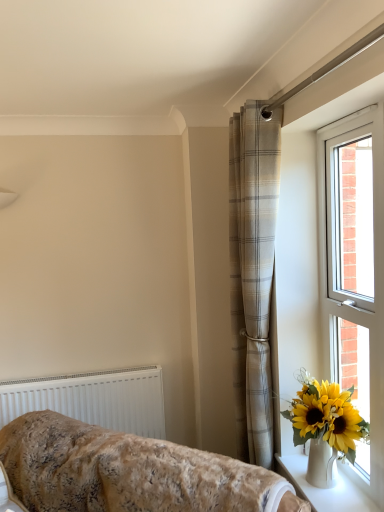
Describe the element at coordinates (128, 472) in the screenshot. I see `fluffy beige blanket at lower left` at that location.

What do you see at coordinates (94, 400) in the screenshot?
I see `white plastic radiator at lower left` at bounding box center [94, 400].

This screenshot has width=384, height=512. I want to click on beige plaid curtain at center, so click(252, 274).

Which of these two, beige plaid curtain at center or white plastic radiator at lower left, is smaller?

Smaller between the two is white plastic radiator at lower left.

Is beige plaid curtain at center facing away from white plastic radiator at lower left?

No, beige plaid curtain at center's orientation is not away from white plastic radiator at lower left.

Considering the sizes of objects beige plaid curtain at center and white plastic radiator at lower left in the image provided, who is thinner, beige plaid curtain at center or white plastic radiator at lower left?

white plastic radiator at lower left.

Between point (256, 360) and point (134, 379), which one is positioned behind?

The point (134, 379) is farther from the camera.

From the image's perspective, which is above, white plastic radiator at lower left or fluffy beige blanket at lower left?

From the image's view, white plastic radiator at lower left is above.

From the picture: From a real-world perspective, between white plastic radiator at lower left and fluffy beige blanket at lower left, who is vertically lower?

fluffy beige blanket at lower left, from a real-world perspective.

Which object is thinner, white plastic radiator at lower left or fluffy beige blanket at lower left?

Thinner between the two is white plastic radiator at lower left.

Considering the sizes of white plastic window at right and beige plaid curtain at center in the image, is white plastic window at right taller or shorter than beige plaid curtain at center?

white plastic window at right is shorter than beige plaid curtain at center.

Would you consider white plastic window at right to be distant from beige plaid curtain at center?

No, white plastic window at right is not far away from beige plaid curtain at center.

Could you tell me if white plastic window at right is turned towards beige plaid curtain at center?

No, white plastic window at right is not facing towards beige plaid curtain at center.

Does white ceramic vase at lower right have a lesser width compared to white plastic window at right?

In fact, white ceramic vase at lower right might be wider than white plastic window at right.

Looking at this image, does white ceramic vase at lower right appear on the left side of white plastic window at right?

Correct, you'll find white ceramic vase at lower right to the left of white plastic window at right.

From their relative heights in the image, would you say white ceramic vase at lower right is taller or shorter than white plastic window at right?

white ceramic vase at lower right is shorter than white plastic window at right.

Is white plastic window at right oriented away from fluffy beige blanket at lower left?

No, white plastic window at right is not facing the opposite direction of fluffy beige blanket at lower left.

This screenshot has width=384, height=512. Find the location of `furniture below the white plastic window at right (from a real-world perspective)`. furniture below the white plastic window at right (from a real-world perspective) is located at coordinates (128, 472).

From the image's perspective, is white plastic window at right over fluffy beige blanket at lower left?

Correct, white plastic window at right appears higher than fluffy beige blanket at lower left in the image.

Could fluffy beige blanket at lower left be considered to be inside white plastic window at right?

No, fluffy beige blanket at lower left is not a part of white plastic window at right.

Considering the relative positions of fluffy beige blanket at lower left and beige plaid curtain at center in the image provided, is fluffy beige blanket at lower left in front of beige plaid curtain at center?

That is True.

From the image's perspective, which one is positioned higher, fluffy beige blanket at lower left or beige plaid curtain at center?

beige plaid curtain at center appears higher in the image.

Considering the sizes of fluffy beige blanket at lower left and beige plaid curtain at center in the image, is fluffy beige blanket at lower left wider or thinner than beige plaid curtain at center?

Clearly, fluffy beige blanket at lower left has more width compared to beige plaid curtain at center.

Based on their sizes in the image, would you say white plastic radiator at lower left is bigger or smaller than white plastic window at right?

Considering their sizes, white plastic radiator at lower left takes up less space than white plastic window at right.

Is the surface of white plastic radiator at lower left in direct contact with white plastic window at right?

white plastic radiator at lower left and white plastic window at right are not in contact.

Which is in front, point (72, 385) or point (344, 306)?

The point (344, 306) is in front.

Is white plastic radiator at lower left facing away from white plastic window at right?

No.

Locate an element on the screen. curtain on the right of white plastic radiator at lower left is located at coordinates (252, 274).

You are a GUI agent. You are given a task and a screenshot of the screen. Output one action in this format:
    pyautogui.click(x=<x>, y=<y>)
    Task: Click on the radiator located on the left of fluffy beige blanket at lower left
    This screenshot has width=384, height=512.
    Given the screenshot: What is the action you would take?
    pyautogui.click(x=94, y=400)

Estimate the real-world distances between objects in this image. Which object is closer to fluffy beige blanket at lower left, white plastic radiator at lower left or white plastic window at right?

Based on the image, white plastic radiator at lower left appears to be nearer to fluffy beige blanket at lower left.

Looking at the image, which one is located further to white plastic radiator at lower left, white plastic window at right or beige plaid curtain at center?

The object further to white plastic radiator at lower left is white plastic window at right.

Based on their spatial positions, is white ceramic vase at lower right or white plastic radiator at lower left further from fluffy beige blanket at lower left?

Based on the image, white plastic radiator at lower left appears to be further to fluffy beige blanket at lower left.

Estimate the real-world distances between objects in this image. Which object is further from white plastic window at right, white plastic radiator at lower left or fluffy beige blanket at lower left?

white plastic radiator at lower left.

Based on the photo, which object lies further to the anchor point beige plaid curtain at center, white plastic window at right or fluffy beige blanket at lower left?

Based on the image, fluffy beige blanket at lower left appears to be further to beige plaid curtain at center.

Estimate the real-world distances between objects in this image. Which object is further from white ceramic vase at lower right, beige plaid curtain at center or white plastic radiator at lower left?

white plastic radiator at lower left is further to white ceramic vase at lower right.

Estimate the real-world distances between objects in this image. Which object is closer to white ceramic vase at lower right, white plastic window at right or fluffy beige blanket at lower left?

white plastic window at right is positioned closer to the anchor white ceramic vase at lower right.

When comparing their distances from white plastic window at right, does beige plaid curtain at center or white plastic radiator at lower left seem closer?

beige plaid curtain at center.

I want to click on curtain between fluffy beige blanket at lower left and white ceramic vase at lower right from left to right, so click(x=252, y=274).

Locate an element on the screen. furniture between white plastic radiator at lower left and white plastic window at right is located at coordinates (128, 472).

Where is `window between beige plaid curtain at center and white ceramic vase at lower right in the vertical direction`? window between beige plaid curtain at center and white ceramic vase at lower right in the vertical direction is located at coordinates (341, 272).

Identify the location of window sill between white plastic radiator at lower left and white plastic window at right. (323, 489).